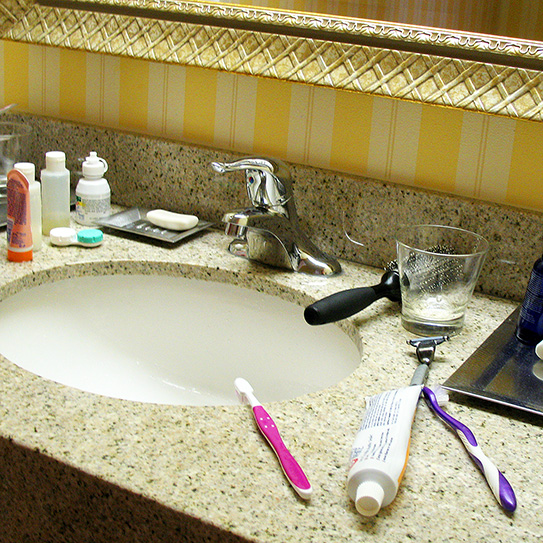
At what (x,y) coordinates should I click in order to perform the action: click on bar of soap. Please return your answer as a coordinate pair (x, y). Looking at the image, I should click on (180, 222).